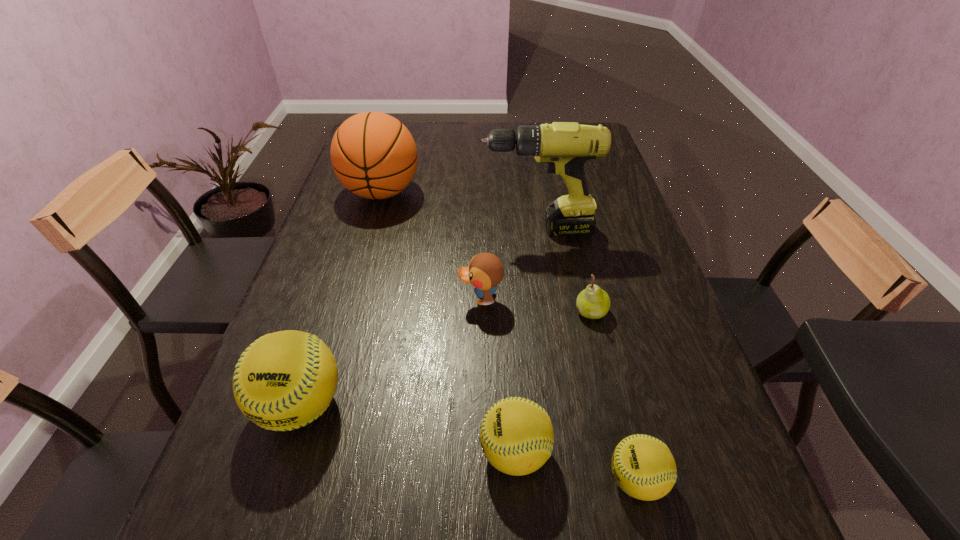
Image resolution: width=960 pixels, height=540 pixels. Find the location of `free space located on the handle side of the tallest object`. free space located on the handle side of the tallest object is located at coordinates (424, 230).

Image resolution: width=960 pixels, height=540 pixels. In order to click on vacant space located 0.300m on the handle side of the tallest object in this screenshot , I will do `click(375, 230)`.

This screenshot has width=960, height=540. What are the coordinates of `free space located 0.350m on the handle side of the tallest object` in the screenshot? It's located at (358, 230).

Identify the location of blank area located 0.130m on the front-facing side of the duck. (404, 300).

Identify the location of free region located 0.250m on the front-facing side of the duck. This screenshot has height=540, width=960. (354, 300).

Image resolution: width=960 pixels, height=540 pixels. Identify the location of vacant position located on the front-facing side of the duck. (384, 300).

This screenshot has width=960, height=540. In order to click on softball at the left edge in this screenshot , I will do `click(284, 380)`.

Where is `basketball located in the left edge section of the desktop`? The image size is (960, 540). basketball located in the left edge section of the desktop is located at coordinates (373, 155).

In order to click on softball situated at the right edge in this screenshot , I will do `click(644, 468)`.

The height and width of the screenshot is (540, 960). What are the coordinates of `pear that is at the right edge` in the screenshot? It's located at [x=593, y=302].